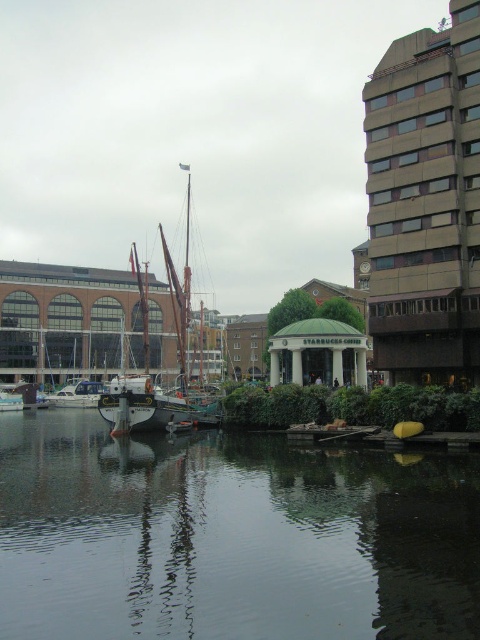
Who is positioned more to the right, smooth dark water at center or wooden dock at center?

From the viewer's perspective, wooden dock at center appears more on the right side.

Which is in front, point (445, 531) or point (331, 429)?

Positioned in front is point (445, 531).

At what (x,y) coordinates should I click in order to perform the action: click on smooth dark water at center. Please return your answer as a coordinate pair (x, y). The image size is (480, 640). Looking at the image, I should click on (229, 536).

What are the coordinates of `smooth dark water at center` in the screenshot? It's located at (229, 536).

Who is more distant from viewer, (107, 502) or (88, 394)?

Positioned behind is point (88, 394).

Identify the location of smooth dark water at center. The image size is (480, 640). (229, 536).

Is wooden sailboat at center closer to camera compared to white glossy boat at center?

That is True.

Does wooden sailboat at center have a lesser width compared to white glossy boat at center?

Incorrect, wooden sailboat at center's width is not less than white glossy boat at center's.

Who is more forward, (x=135, y=385) or (x=78, y=390)?

Point (x=135, y=385) is in front.

At what (x,y) coordinates should I click in order to perform the action: click on wooden sailboat at center. Please return your answer as a coordinate pair (x, y). The image size is (480, 640). Looking at the image, I should click on (148, 371).